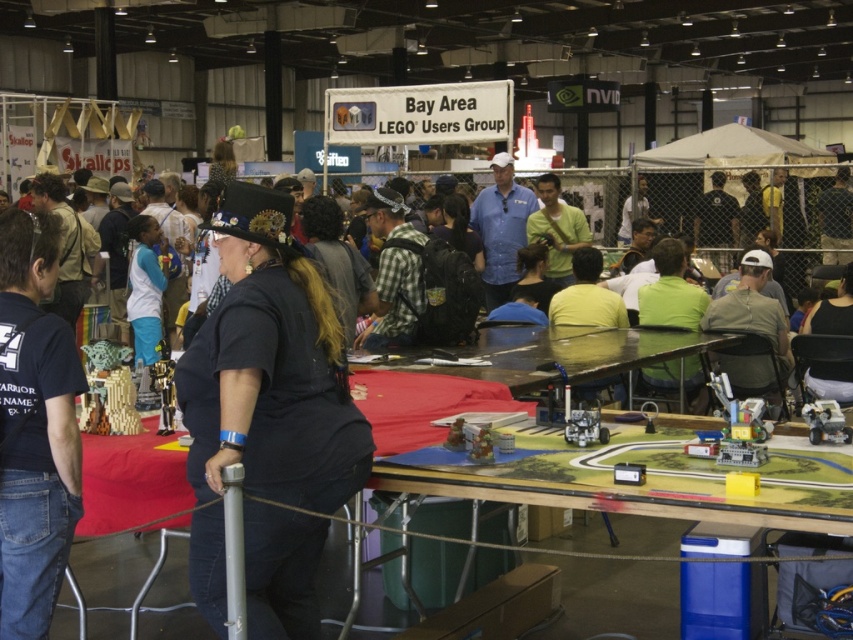
Can you confirm if gray fabric shirt at right is thinner than blue shirt at center?

Correct, gray fabric shirt at right's width is less than blue shirt at center's.

Can you confirm if gray fabric shirt at right is positioned below blue shirt at center?

Yes, gray fabric shirt at right is below blue shirt at center.

Is point (735, 294) farther from viewer compared to point (498, 168)?

No, it is in front of (498, 168).

At what (x,y) coordinates should I click in order to perform the action: click on gray fabric shirt at right. Please return your answer as a coordinate pair (x, y). Looking at the image, I should click on (752, 308).

Which is in front, point (770, 497) or point (494, 188)?

Point (770, 497) is in front.

Locate an element on the screen. wooden table at center is located at coordinates (653, 477).

Find the location of a particular element. The width and height of the screenshot is (853, 640). wooden table at center is located at coordinates (653, 477).

Is black matte vest at center thinner than gray fabric shirt at right?

Yes.

Can you confirm if black matte vest at center is bigger than gray fabric shirt at right?

Actually, black matte vest at center might be smaller than gray fabric shirt at right.

Measure the distance between black matte vest at center and camera.

3.01 meters

Image resolution: width=853 pixels, height=640 pixels. In order to click on black matte vest at center in this screenshot , I will do `click(270, 369)`.